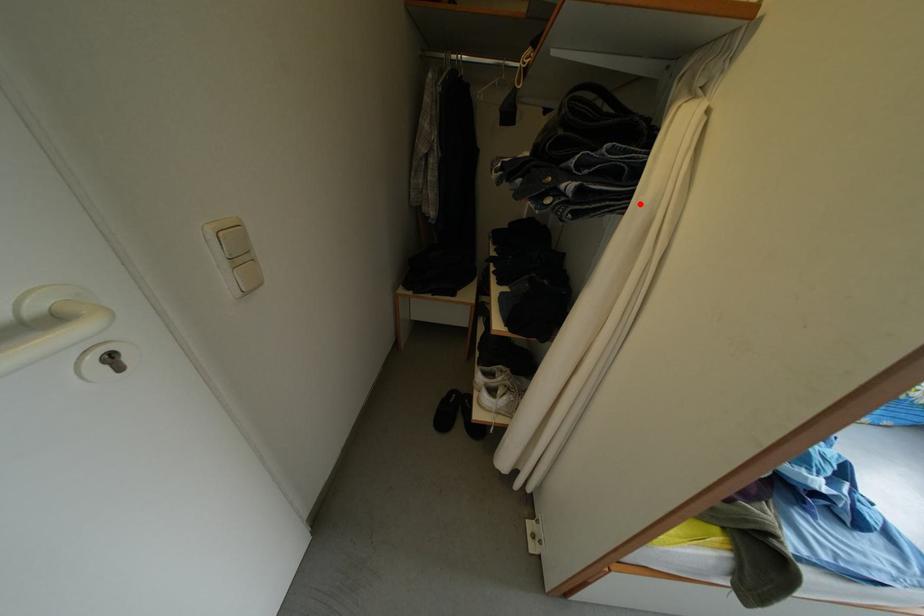
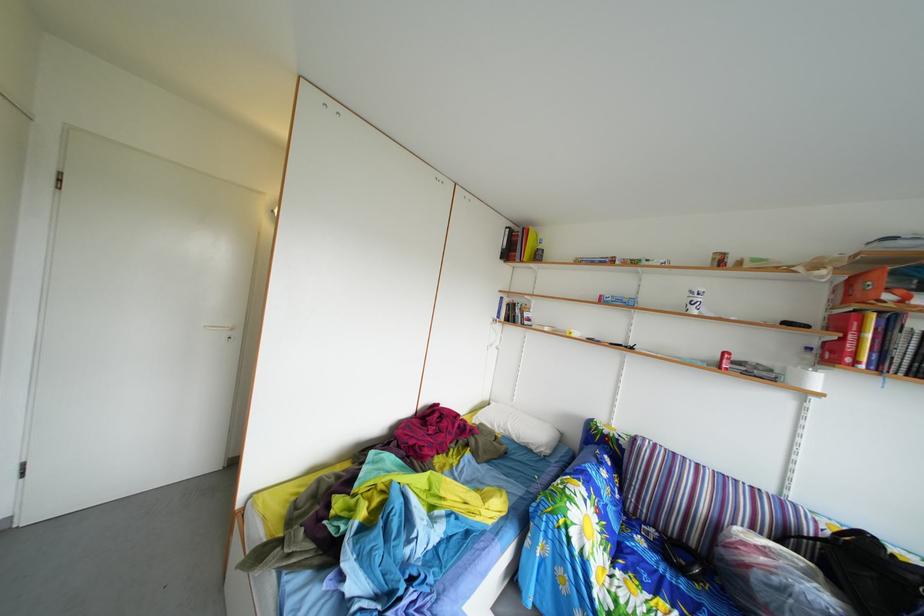
Question: I am providing you with two images of the same scene from different viewpoints. A red point is marked on the first image. Can you still see the location of the red point in image 2?

Choices:
 (A) Yes
 (B) No

Answer: (B)